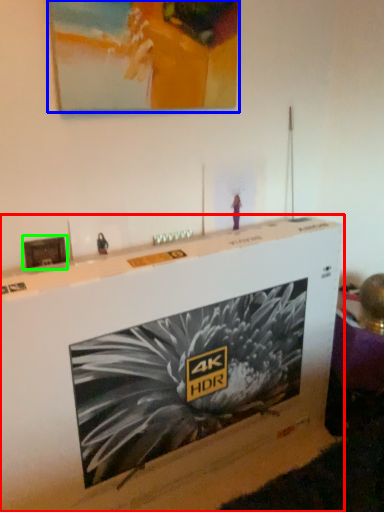
Question: Which object is the closest to the furniture (highlighted by a red box)? Choose among these: picture frame (highlighted by a blue box) or picture frame (highlighted by a green box).

Choices:
 (A) picture frame
 (B) picture frame

Answer: (B)